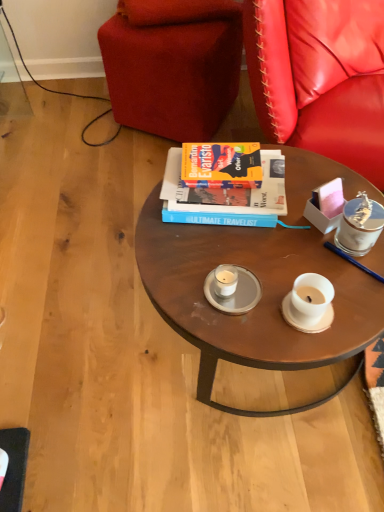
The height and width of the screenshot is (512, 384). I want to click on free space above wooden round table at center (from a real-world perspective), so click(267, 247).